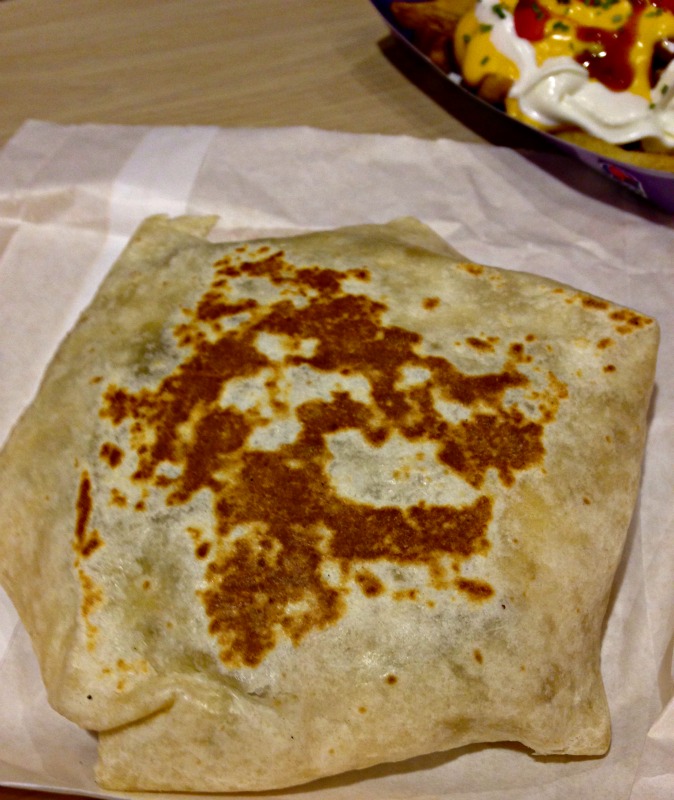
The width and height of the screenshot is (674, 800). In order to click on plate in this screenshot , I will do `click(634, 166)`.